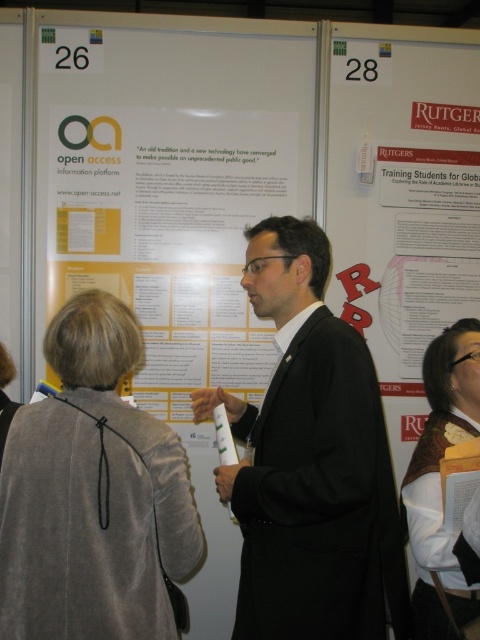
Is point (260, 285) positioned after point (428, 497)?

Yes, point (260, 285) is behind point (428, 497).

Looking at this image, does black matte suit at center appear under white fabric scarf at center?

Actually, black matte suit at center is above white fabric scarf at center.

Image resolution: width=480 pixels, height=640 pixels. Describe the element at coordinates (311, 461) in the screenshot. I see `black matte suit at center` at that location.

Image resolution: width=480 pixels, height=640 pixels. Find the location of `black matte suit at center`. black matte suit at center is located at coordinates (311, 461).

Is black matte suit at center further to the viewer compared to velvet gray blazer at center?

Yes, black matte suit at center is behind velvet gray blazer at center.

Does black matte suit at center appear under velvet gray blazer at center?

No, black matte suit at center is not below velvet gray blazer at center.

Is point (238, 515) positioned after point (154, 435)?

Yes, it is behind point (154, 435).

You are a GUI agent. You are given a task and a screenshot of the screen. Output one action in this format:
    pyautogui.click(x=<x>, y=<y>)
    Task: Click on the black matte suit at center
    The image size is (480, 640).
    Given the screenshot: What is the action you would take?
    pyautogui.click(x=311, y=461)

Is velvet gray blazer at center shorter than white fabric scarf at center?

Correct, velvet gray blazer at center is not as tall as white fabric scarf at center.

Which is below, velvet gray blazer at center or white fabric scarf at center?

white fabric scarf at center

The image size is (480, 640). What are the coordinates of `velvet gray blazer at center` in the screenshot? It's located at (93, 493).

What are the coordinates of `velvet gray blazer at center` in the screenshot? It's located at (93, 493).